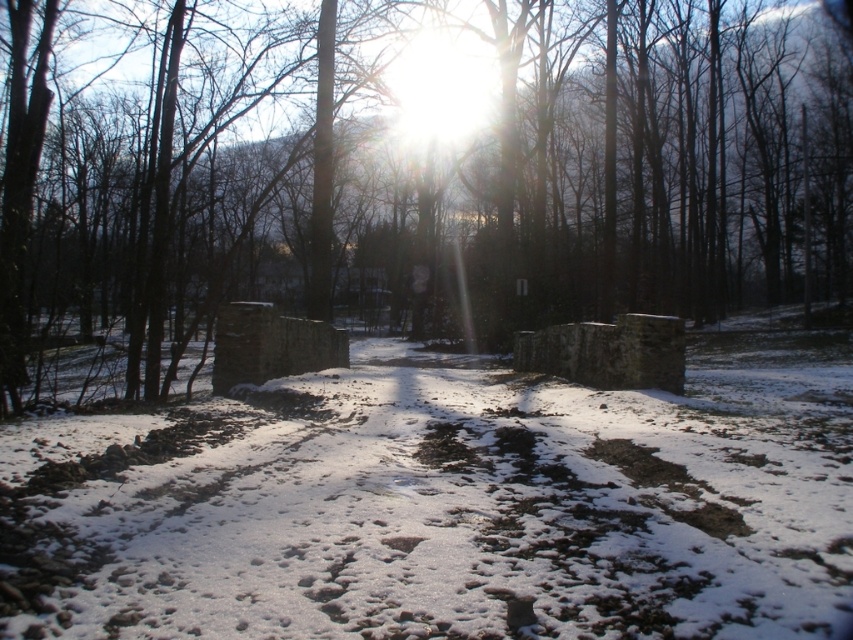
Does brown wood tree at center have a smaller size compared to white powdery snow at center?

Actually, brown wood tree at center might be larger than white powdery snow at center.

Between point (566, 51) and point (242, 528), which one is positioned in front?

Positioned in front is point (242, 528).

The width and height of the screenshot is (853, 640). Describe the element at coordinates (427, 168) in the screenshot. I see `brown wood tree at center` at that location.

At what (x,y) coordinates should I click in order to perform the action: click on brown wood tree at center. Please return your answer as a coordinate pair (x, y). This screenshot has height=640, width=853. Looking at the image, I should click on 427,168.